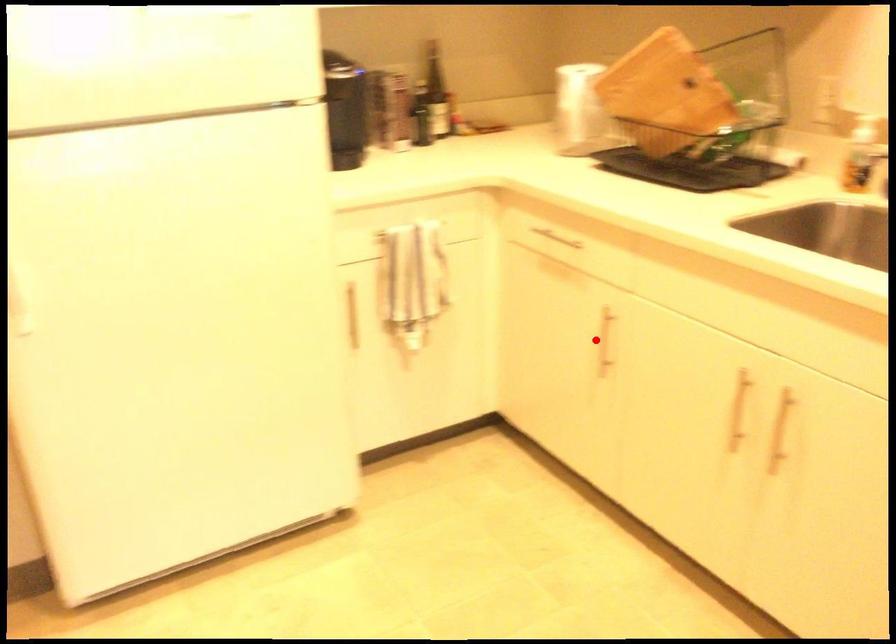
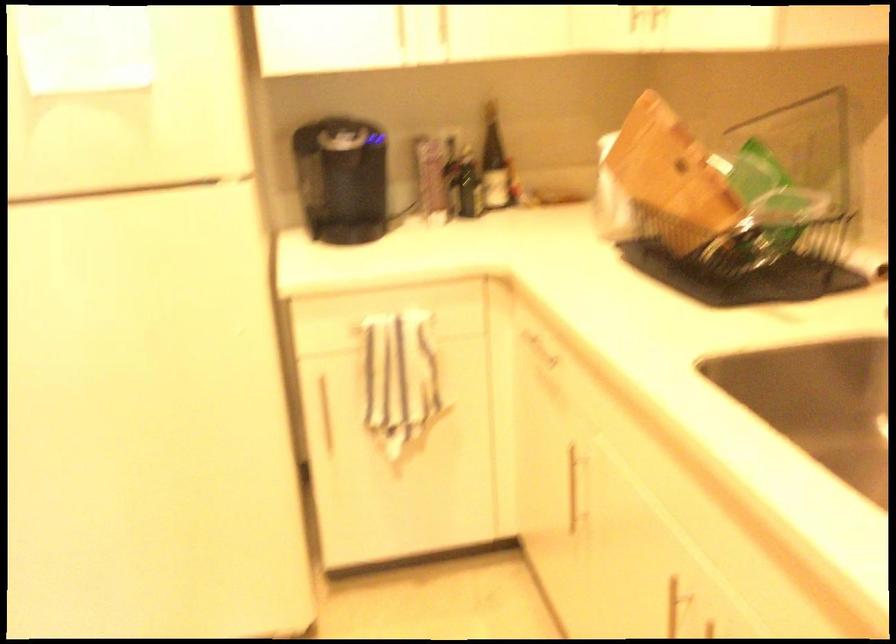
Question: I am providing you with two images of the same scene from different viewpoints. A red point is marked on the first image. Is the red point's position out of view in image 2?

Choices:
 (A) Yes
 (B) No

Answer: (B)